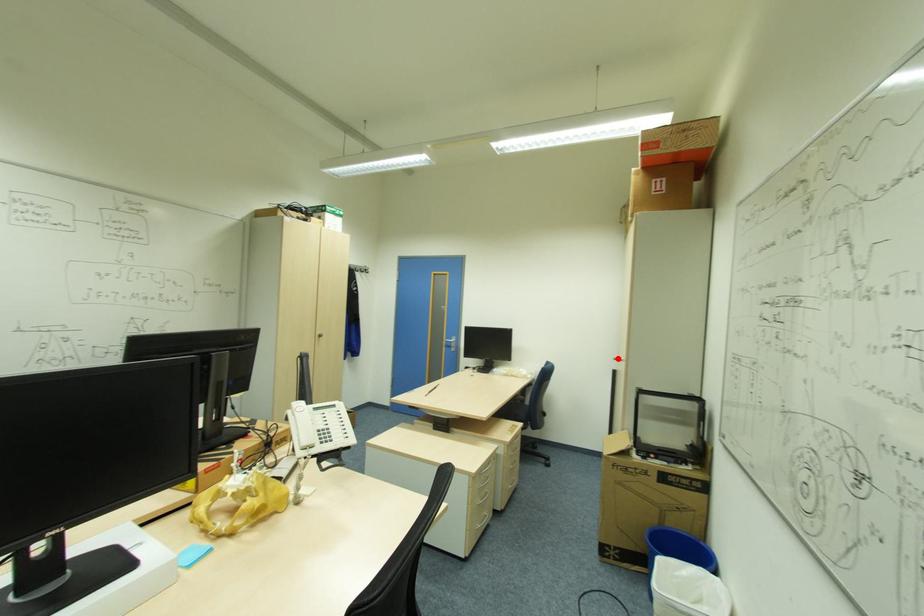
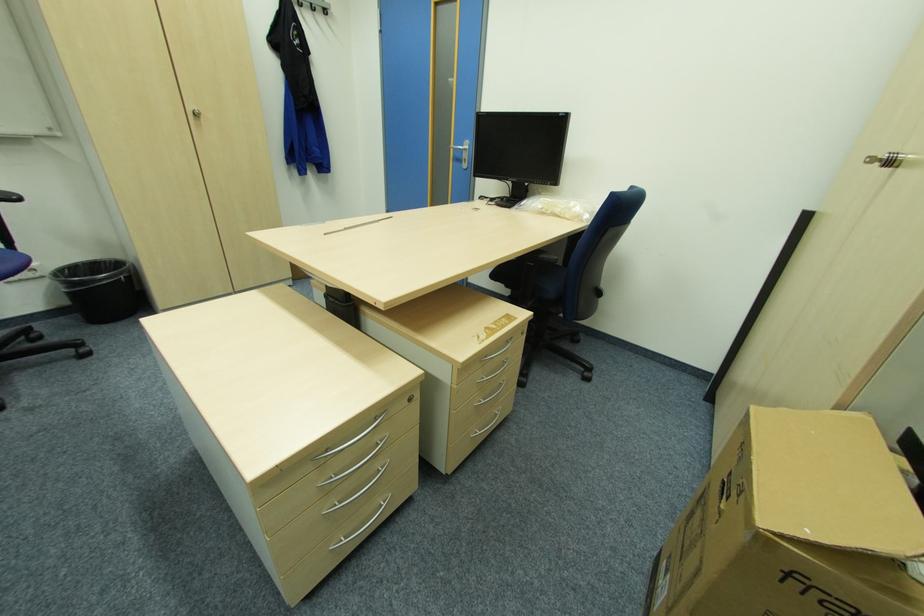
The point at the highlighted location is marked in the first image. Where is the corresponding point in the second image?

(873, 159)